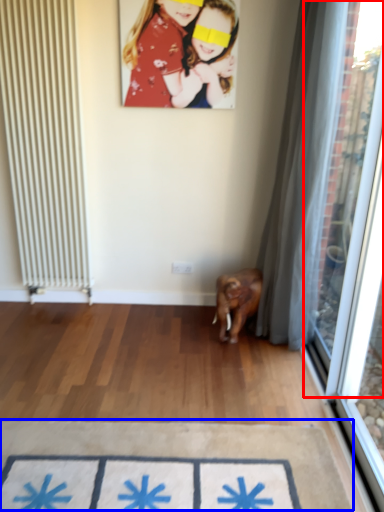
Question: Which point is closer to the camera, window screen (highlighted by a red box) or doormat (highlighted by a blue box)?

Choices:
 (A) window screen
 (B) doormat

Answer: (A)